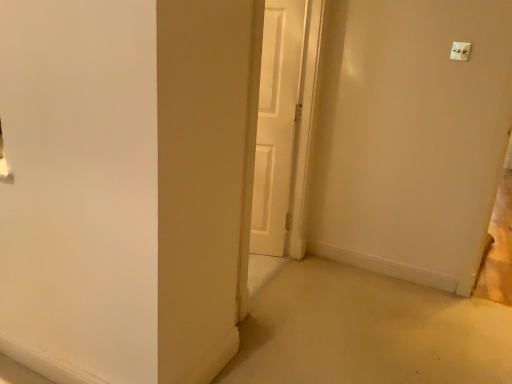
Question: From their relative heights in the image, would you say white plastic light switch at upper right is taller or shorter than white matte door at center?

Choices:
 (A) short
 (B) tall

Answer: (A)

Question: From the image's perspective, relative to white matte door at center, is white plastic light switch at upper right above or below?

Choices:
 (A) above
 (B) below

Answer: (A)

Question: From a real-world perspective, is white plastic light switch at upper right positioned above or below white matte door at center?

Choices:
 (A) above
 (B) below

Answer: (A)

Question: Visually, is white matte door at center positioned to the left or to the right of white plastic light switch at upper right?

Choices:
 (A) right
 (B) left

Answer: (B)

Question: From their relative heights in the image, would you say white matte door at center is taller or shorter than white plastic light switch at upper right?

Choices:
 (A) tall
 (B) short

Answer: (A)

Question: From the image's perspective, is white matte door at center located above or below white plastic light switch at upper right?

Choices:
 (A) above
 (B) below

Answer: (B)

Question: Relative to white plastic light switch at upper right, is white matte door at center in front or behind?

Choices:
 (A) front
 (B) behind

Answer: (B)